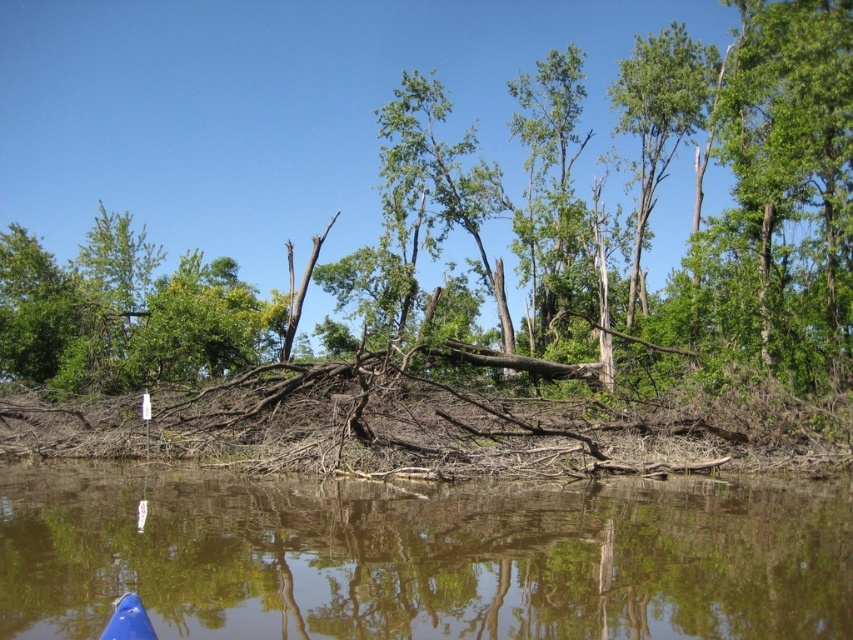
You are standing on the shore of a lake and see the brown rough wood at center and the brown wood at lower center in the water. If you want to retrieve both pieces of wood, which one is closer to you?

→ The brown wood at lower center is closer to you since it is only 28.18 meters away from the brown rough wood at center, which is farther away.

You are an observer standing on the shore looking at the water. You see two pieces of wood in the water. The first is brown rough wood at center and the second is brown wood at lower center. Which piece of wood is taller?

The brown rough wood at center is much taller than the brown wood at lower center.

You are navigating a small boat on the water and see two points marked in the scene. Which point, point (798, 275) or point (643, 488), is closer to your boat?

Point (798, 275) is closer to the boat because it is further to the viewer than point (643, 488), meaning it appears nearer in the scene.